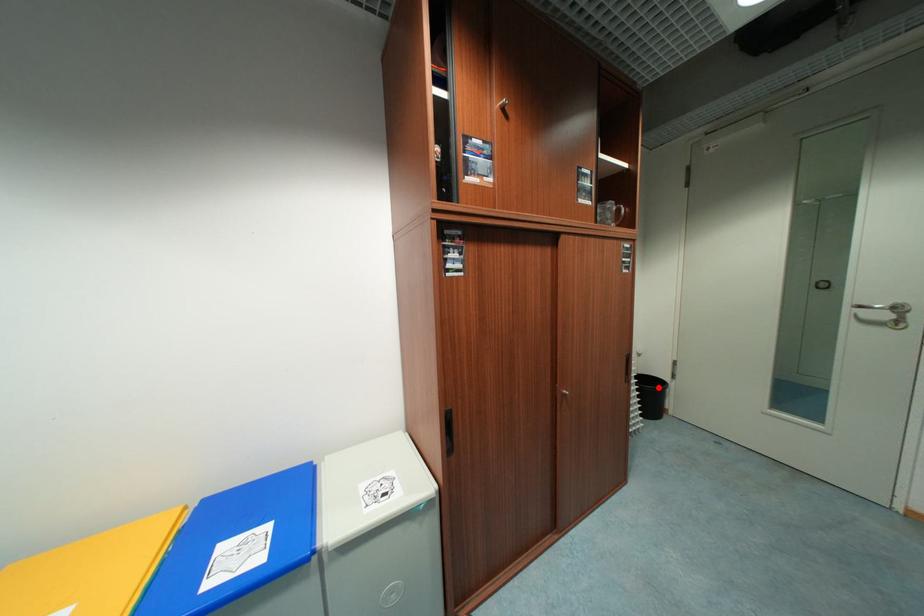
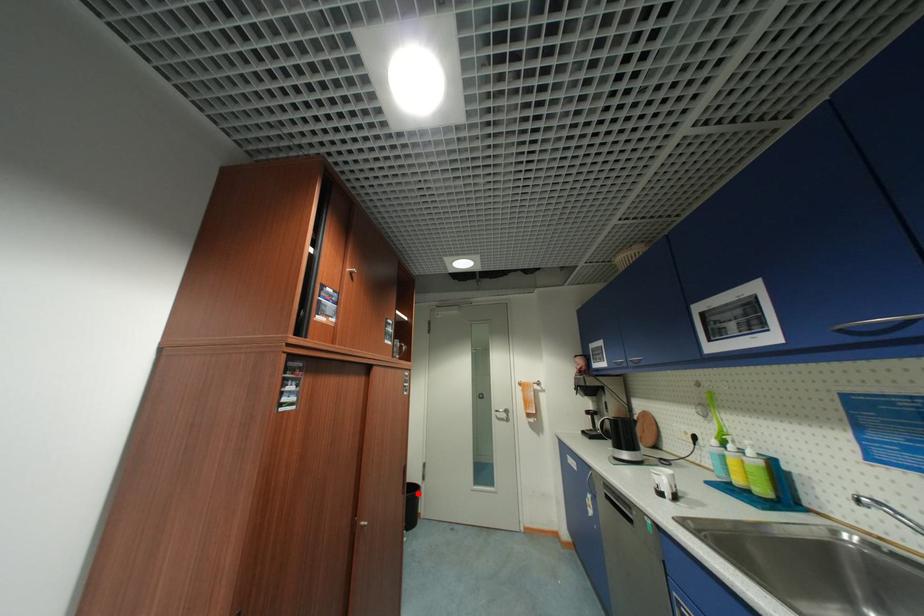
I am providing you with two images of the same scene from different viewpoints. A red point is marked on the first image and another point is marked on the second image. Is the marked point in image1 the same physical position as the marked point in image2?

Yes